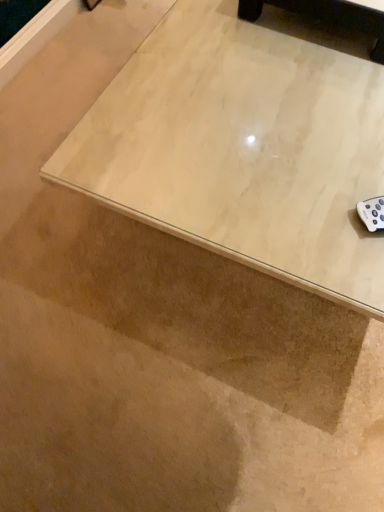
I want to click on vacant space to the left of light wood coffee table at upper center, so click(205, 41).